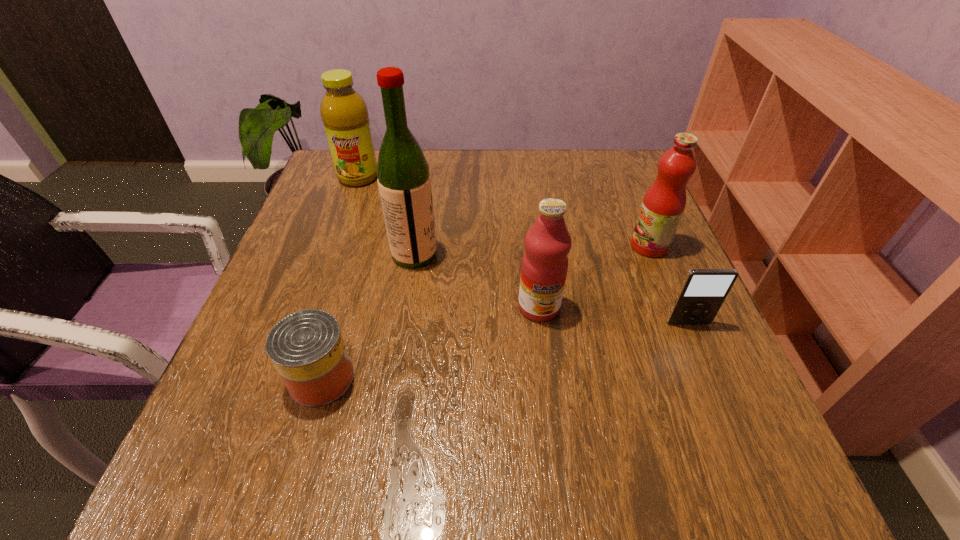
Point out which object is positioned as the nearest to the liquor. Please provide its 2D coordinates. Your answer should be formatted as a tuple, i.e. [(x, y)], where the tuple contains the x and y coordinates of a point satisfying the conditions above.

[(544, 267)]

I want to click on object that stands as the fifth closest to the iPod, so [344, 113].

This screenshot has width=960, height=540. Find the location of `fruit juice that is the closest to the farthest object`. fruit juice that is the closest to the farthest object is located at coordinates (544, 267).

Locate an element on the screen. the second closest fruit juice to the liquor is located at coordinates (344, 113).